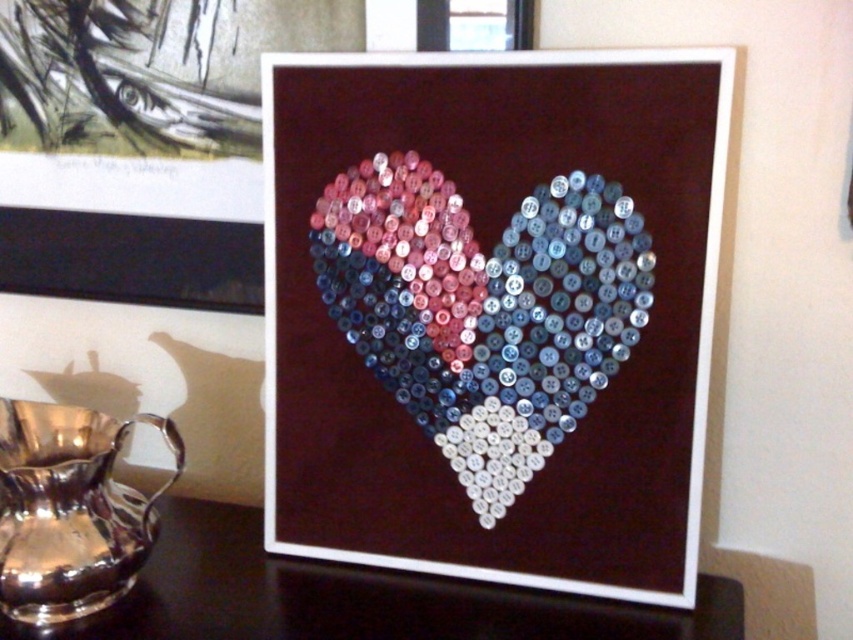
You are arranging flowers on a table and see the shiny plastic heart at center and the black glossy table at center. Which object is positioned to the right side of the table?

The shiny plastic heart at center is positioned to the right of the black glossy table at center according to the description.

You are arranging flowers and have a vase that is 15 cm in diameter. You see the black glossy table at center and the shiny silver pitcher at lower left. Which object can accommodate the vase without it overhanging the edge?

The black glossy table at center is larger in size than the shiny silver pitcher at lower left, so the vase can be placed on the black glossy table at center without overhanging the edge.

You are an interior designer arranging items on a shelf. You have the shiny plastic heart at center and the shiny silver pitcher at lower left. If you want to place them side by side without overlapping, which one should you place first to ensure there is enough space?

The shiny plastic heart at center is wider than the shiny silver pitcher at lower left, so you should place the shiny plastic heart at center first to ensure there is enough space for both items side by side.